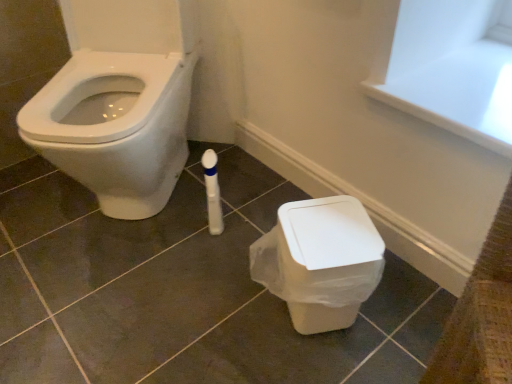
The height and width of the screenshot is (384, 512). I want to click on empty space that is ontop of white plastic bin at lower right (from a real-world perspective), so click(x=325, y=225).